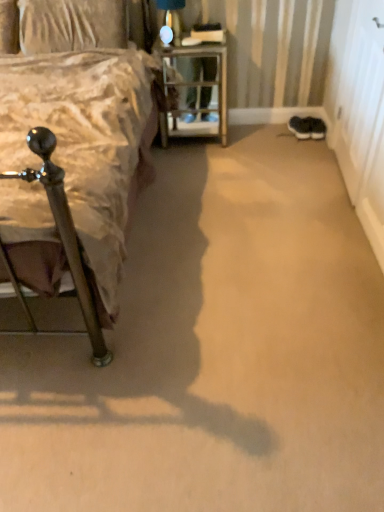
Where is `free space in front of white wood screen door at right`? This screenshot has height=512, width=384. free space in front of white wood screen door at right is located at coordinates (329, 209).